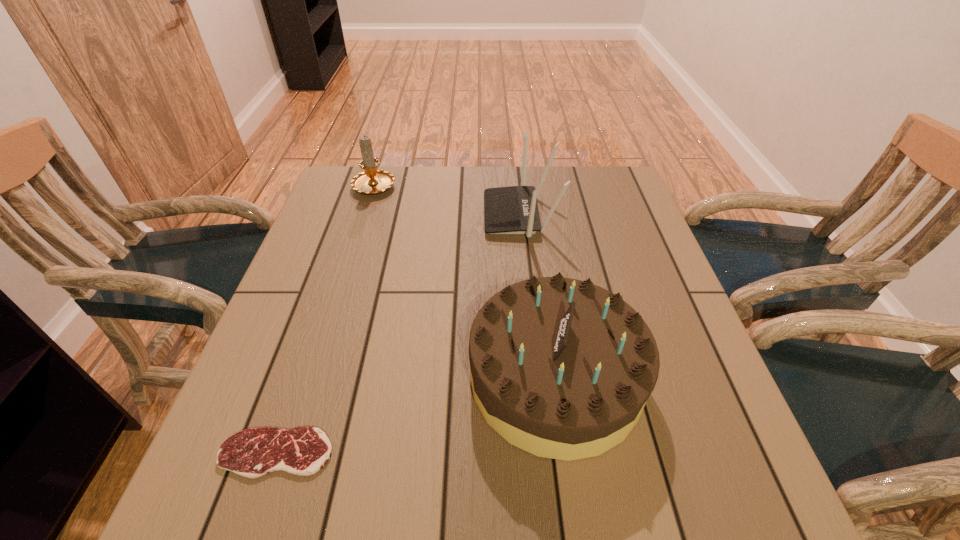
You are a GUI agent. You are given a task and a screenshot of the screen. Output one action in this format:
    pyautogui.click(x=<x>, y=<y>)
    Task: Click on the router
    The width and height of the screenshot is (960, 540).
    Given the screenshot: What is the action you would take?
    pyautogui.click(x=507, y=210)

Image resolution: width=960 pixels, height=540 pixels. Find the location of `candle`. candle is located at coordinates (372, 181).

Locate an element on the screen. birthday cake is located at coordinates (561, 368).

Find the location of a particular element. This screenshot has width=960, height=540. the shortest object is located at coordinates (303, 451).

At what (x,y) coordinates should I click in order to perform the action: click on vacant space located on the front-facing side of the router. Please return your answer as a coordinate pair (x, y). The width and height of the screenshot is (960, 540). Looking at the image, I should click on (408, 215).

You are a GUI agent. You are given a task and a screenshot of the screen. Output one action in this format:
    pyautogui.click(x=<x>, y=<y>)
    Task: Click on the free space located on the front-facing side of the router
    
    Given the screenshot: What is the action you would take?
    pyautogui.click(x=365, y=215)

At what (x,y) coordinates should I click in order to perform the action: click on free location located 0.380m on the front-facing side of the router. Please return your answer as a coordinate pair (x, y). Looking at the image, I should click on (347, 215).

Find the location of a particular element. free space located 0.240m on the right of the candle is located at coordinates (476, 185).

Locate an element on the screen. This screenshot has width=960, height=540. free space located 0.240m on the front-facing side of the birthday cake is located at coordinates (344, 378).

The image size is (960, 540). I want to click on free space located 0.230m on the front-facing side of the birthday cake, so click(x=349, y=378).